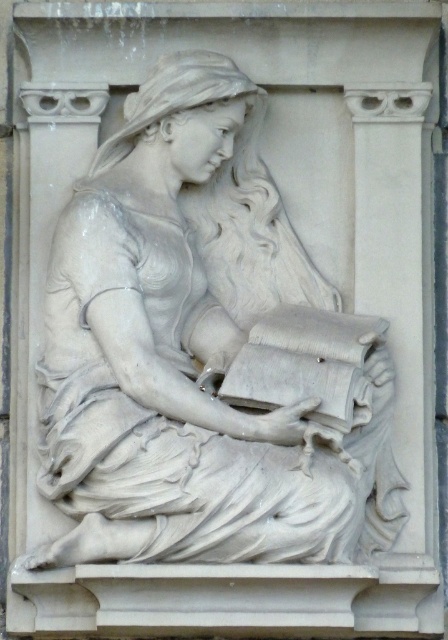
Question: Is white marble statue at center thinner than smooth white book at center?

Choices:
 (A) yes
 (B) no

Answer: (B)

Question: Does white marble statue at center have a lesser width compared to smooth white book at center?

Choices:
 (A) no
 (B) yes

Answer: (A)

Question: Does white marble statue at center appear on the right side of smooth white book at center?

Choices:
 (A) yes
 (B) no

Answer: (B)